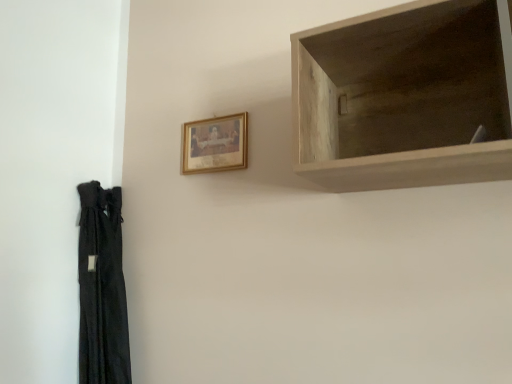
This screenshot has height=384, width=512. What do you see at coordinates (215, 144) in the screenshot?
I see `gold-framed picture at upper center` at bounding box center [215, 144].

The image size is (512, 384). What are the coordinates of `gold-framed picture at upper center` in the screenshot? It's located at (215, 144).

The image size is (512, 384). Describe the element at coordinates (402, 98) in the screenshot. I see `light wood shelf at upper right` at that location.

Looking at this image, measure the distance between light wood shelf at upper right and camera.

A distance of 27.23 inches exists between light wood shelf at upper right and camera.

Image resolution: width=512 pixels, height=384 pixels. I want to click on light wood shelf at upper right, so tap(402, 98).

This screenshot has width=512, height=384. In order to click on gold-framed picture at upper center in this screenshot , I will do `click(215, 144)`.

Considering the positions of objects light wood shelf at upper right and gold-framed picture at upper center in the image provided, who is more to the right, light wood shelf at upper right or gold-framed picture at upper center?

From the viewer's perspective, light wood shelf at upper right appears more on the right side.

Considering their positions, is light wood shelf at upper right located in front of or behind gold-framed picture at upper center?

In the image, light wood shelf at upper right appears in front of gold-framed picture at upper center.

Which is nearer, (418, 108) or (212, 119)?

The point (418, 108) is closer to the camera.

From the image's perspective, which one is positioned lower, light wood shelf at upper right or gold-framed picture at upper center?

From the image's view, gold-framed picture at upper center is below.

From a real-world perspective, which is physically below, light wood shelf at upper right or gold-framed picture at upper center?

light wood shelf at upper right, from a real-world perspective.

Between light wood shelf at upper right and gold-framed picture at upper center, which one has smaller width?

Thinner between the two is gold-framed picture at upper center.

Considering the relative sizes of light wood shelf at upper right and gold-framed picture at upper center in the image provided, is light wood shelf at upper right taller than gold-framed picture at upper center?

Yes, light wood shelf at upper right is taller than gold-framed picture at upper center.

In terms of size, does light wood shelf at upper right appear bigger or smaller than gold-framed picture at upper center?

Considering their sizes, light wood shelf at upper right takes up more space than gold-framed picture at upper center.

Is gold-framed picture at upper center located within light wood shelf at upper right?

No, gold-framed picture at upper center is not a part of light wood shelf at upper right.

Is light wood shelf at upper right far from gold-framed picture at upper center?

light wood shelf at upper right is near gold-framed picture at upper center, not far away.

Is light wood shelf at upper right aimed at gold-framed picture at upper center?

No, light wood shelf at upper right does not turn towards gold-framed picture at upper center.

How different are the orientations of light wood shelf at upper right and gold-framed picture at upper center in degrees?

The facing directions of light wood shelf at upper right and gold-framed picture at upper center are 4.06 degrees apart.

Find the location of a particular element. This screenshot has height=384, width=512. picture frame located above the light wood shelf at upper right (from a real-world perspective) is located at coordinates coord(215,144).

Between gold-framed picture at upper center and light wood shelf at upper right, which one appears on the left side from the viewer's perspective?

gold-framed picture at upper center.

Which object is more forward, gold-framed picture at upper center or light wood shelf at upper right?

light wood shelf at upper right is in front.

Which point is more distant from viewer, (x=244, y=148) or (x=310, y=92)?

The point (x=244, y=148) is behind.

From the image's perspective, is gold-framed picture at upper center located above light wood shelf at upper right?

No.

From a real-world perspective, which object rests below the other?

light wood shelf at upper right, from a real-world perspective.

Can you confirm if gold-framed picture at upper center is thinner than light wood shelf at upper right?

Correct, the width of gold-framed picture at upper center is less than that of light wood shelf at upper right.

Who is shorter, gold-framed picture at upper center or light wood shelf at upper right?

With less height is gold-framed picture at upper center.

Can you confirm if gold-framed picture at upper center is bigger than light wood shelf at upper right?

No.

Is gold-framed picture at upper center positioned beyond the bounds of light wood shelf at upper right?

gold-framed picture at upper center lies outside light wood shelf at upper right's area.

Is gold-framed picture at upper center positioned far away from light wood shelf at upper right?

No, gold-framed picture at upper center is in close proximity to light wood shelf at upper right.

Is gold-framed picture at upper center facing away from light wood shelf at upper right?

No.

Can you tell me how much gold-framed picture at upper center and light wood shelf at upper right differ in facing direction?

The angular difference between gold-framed picture at upper center and light wood shelf at upper right is 4.06 degrees.

How distant is gold-framed picture at upper center from light wood shelf at upper right?

The distance of gold-framed picture at upper center from light wood shelf at upper right is 18.37 inches.

Where is `picture frame on the left of light wood shelf at upper right`? picture frame on the left of light wood shelf at upper right is located at coordinates (215, 144).

Image resolution: width=512 pixels, height=384 pixels. What are the coordinates of `shelf directly beneath the gold-framed picture at upper center (from a real-world perspective)` in the screenshot? It's located at (402, 98).

Identify the location of picture frame that is above the light wood shelf at upper right (from a real-world perspective). (215, 144).